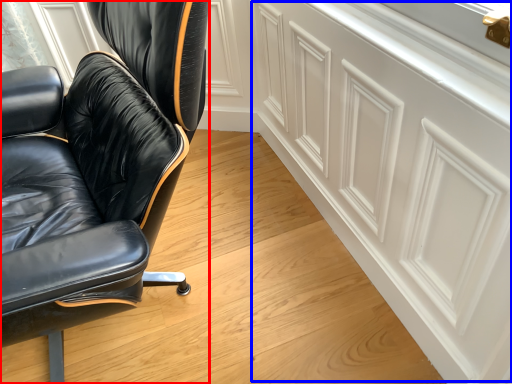
Question: Which point is closer to the camera, chair (highlighted by a red box) or cabinetry (highlighted by a blue box)?

Choices:
 (A) chair
 (B) cabinetry

Answer: (A)